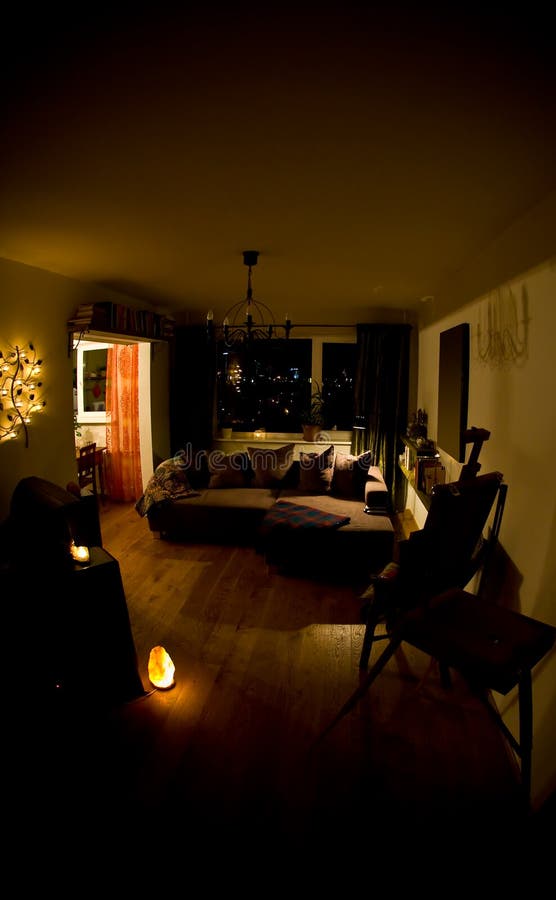
What are the coordinates of `curtains` in the screenshot? It's located at point(123,374), point(192,361), point(378,355).